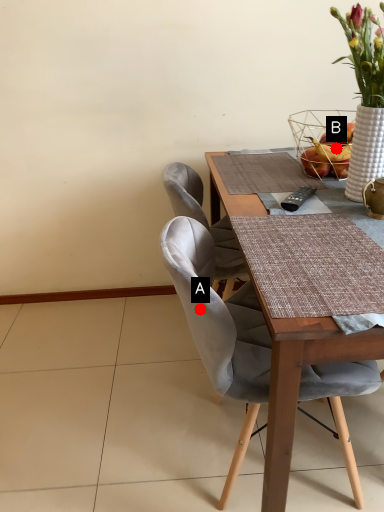
Question: Two points are circled on the image, labeled by A and B beside each circle. Which point appears closest to the camera in this image?

Choices:
 (A) A is closer
 (B) B is closer

Answer: (A)